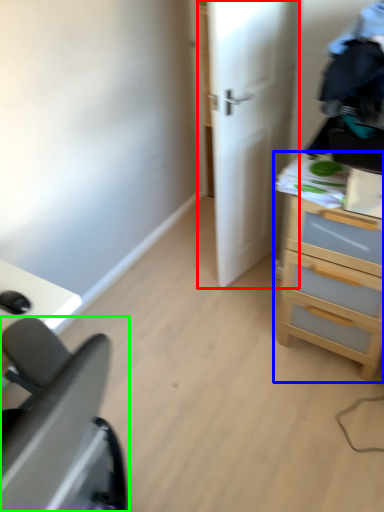
Question: Considering the real-world distances, which object is closest to door (highlighted by a red box)? chest of drawers (highlighted by a blue box) or furniture (highlighted by a green box).

Choices:
 (A) chest of drawers
 (B) furniture

Answer: (A)